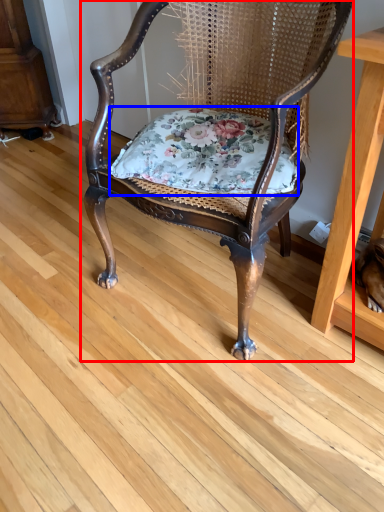
Question: Which object appears farthest to the camera in this image, chair (highlighted by a red box) or blanket (highlighted by a blue box)?

Choices:
 (A) chair
 (B) blanket

Answer: (B)